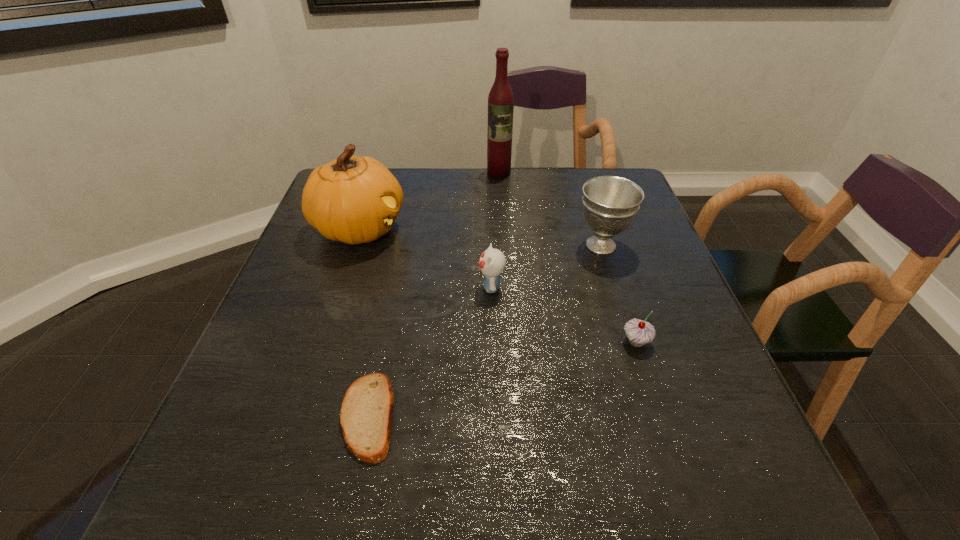
You are a GUI agent. You are given a task and a screenshot of the screen. Output one action in this format:
    pyautogui.click(x=<x>, y=<y>)
    Task: Click on the tallest object
    Image resolution: width=960 pixels, height=540 pixels.
    Given the screenshot: What is the action you would take?
    pyautogui.click(x=500, y=99)

Locate an element on the screen. This screenshot has width=960, height=540. liquor is located at coordinates (500, 99).

Where is `pumpkin`? This screenshot has width=960, height=540. pumpkin is located at coordinates (354, 199).

You are a GUI agent. You are given a task and a screenshot of the screen. Output one action in this format:
    pyautogui.click(x=<x>, y=<y>)
    Task: Click on the fourth shortest object
    The image size is (960, 540).
    Given the screenshot: What is the action you would take?
    pyautogui.click(x=610, y=203)

Find the location of a particular element. the fourth tallest object is located at coordinates (492, 262).

Identify the location of the fourth farthest object. (492, 262).

You are a GUI agent. You are given a task and a screenshot of the screen. Output one action in this format:
    pyautogui.click(x=<x>, y=<y>)
    Task: Click on the cupcake
    The width and height of the screenshot is (960, 540).
    Given the screenshot: What is the action you would take?
    pyautogui.click(x=639, y=332)

Find the location of `the second nearest object`. the second nearest object is located at coordinates (639, 332).

Where is `pita bread`? The width and height of the screenshot is (960, 540). pita bread is located at coordinates (366, 415).

I want to click on the shortest object, so click(366, 415).